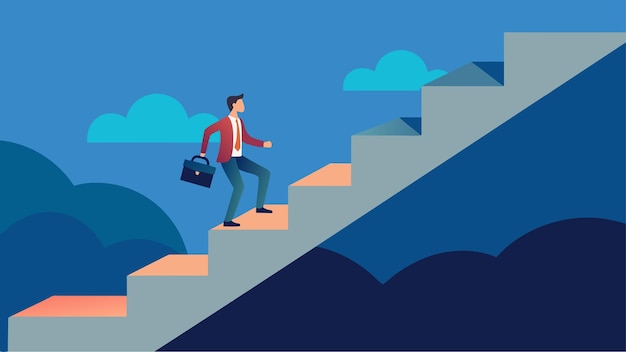
You are a GUI agent. You are given a task and a screenshot of the screen. Output one action in this format:
    pyautogui.click(x=<x>, y=<y>)
    Task: Click on the stairs
    
    Given the screenshot: What is the action you would take?
    pyautogui.click(x=81, y=303), pyautogui.click(x=171, y=265), pyautogui.click(x=274, y=224), pyautogui.click(x=330, y=175), pyautogui.click(x=394, y=125), pyautogui.click(x=470, y=78), pyautogui.click(x=531, y=33)